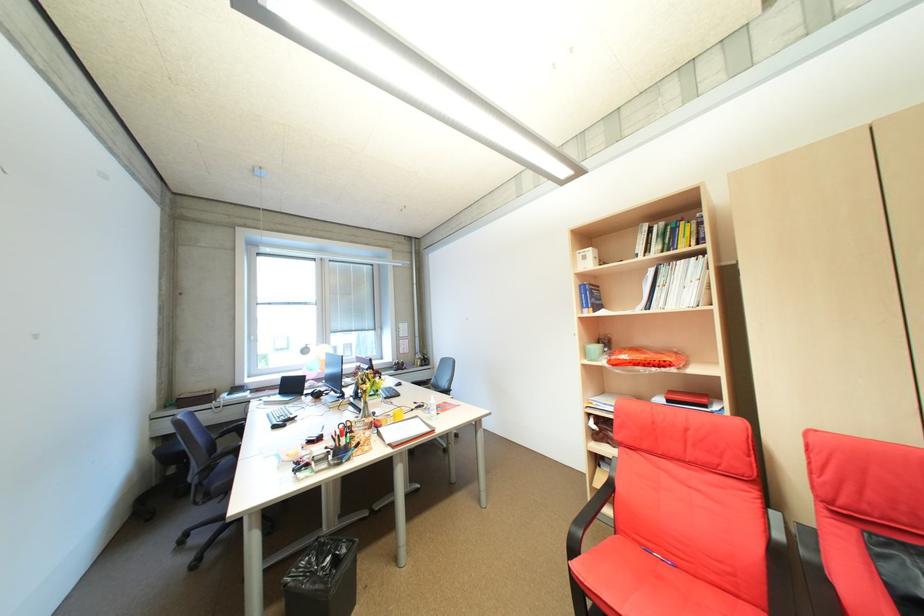
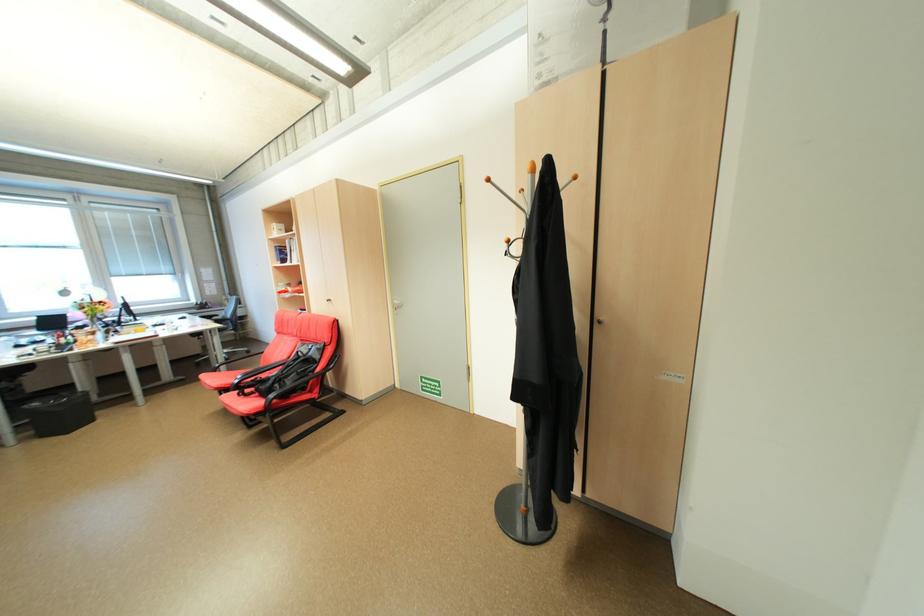
Which direction would the cameraman need to move to produce the second image?

The cameraman walked toward right, backward.